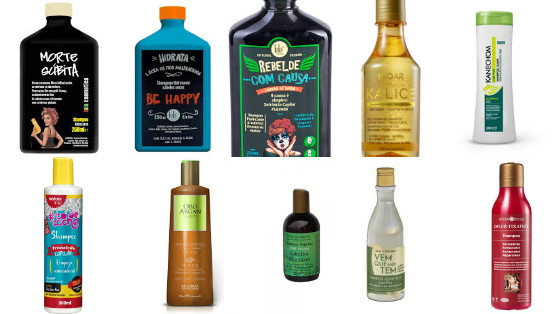
You are a GUI agent. You are given a task and a screenshot of the screen. Output one action in this format:
    pyautogui.click(x=<x>, y=<y>)
    Task: Click on the bottle
    The image size is (560, 314).
    Given the screenshot: What is the action you would take?
    [x=88, y=99], [x=167, y=99], [x=270, y=107], [x=386, y=101], [x=499, y=91], [x=70, y=252], [x=198, y=252], [x=291, y=246], [x=389, y=243], [x=515, y=238]